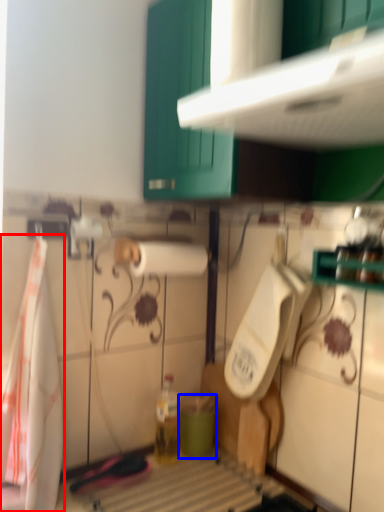
Question: Which object is further to the camera taking this photo, beach towel (highlighted by a red box) or teal (highlighted by a blue box)?

Choices:
 (A) beach towel
 (B) teal

Answer: (B)